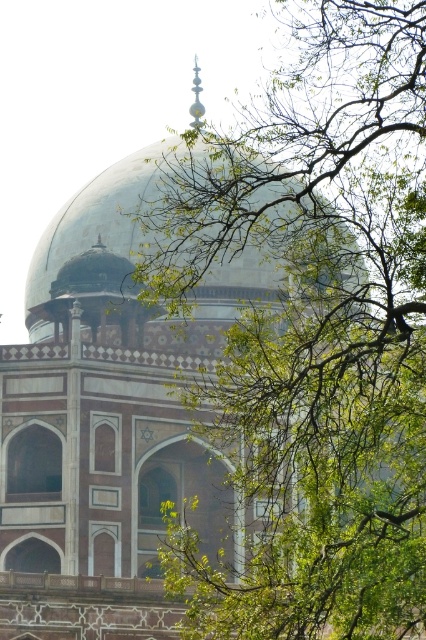
Question: Does green leafy branches at upper center appear over green glass dome at center?

Choices:
 (A) no
 (B) yes

Answer: (A)

Question: Which object is closer to the camera taking this photo?

Choices:
 (A) green glass dome at center
 (B) green leafy branches at upper center

Answer: (B)

Question: Does green leafy branches at upper center appear under green glass dome at center?

Choices:
 (A) no
 (B) yes

Answer: (B)

Question: Which of the following is the closest to the observer?

Choices:
 (A) (379, 88)
 (B) (213, 230)

Answer: (A)

Question: Does green leafy branches at upper center appear under green glass dome at center?

Choices:
 (A) yes
 (B) no

Answer: (A)